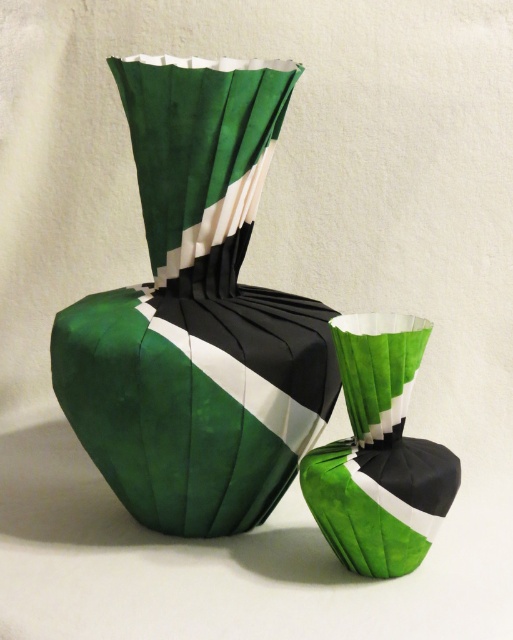
Is green paper vase at center wider than green paper at center?

Correct, the width of green paper vase at center exceeds that of green paper at center.

Which of these two, green paper vase at center or green paper at center, stands taller?

Standing taller between the two is green paper vase at center.

Does point (235, 61) lie behind point (404, 403)?

Yes, it is.

Where is `green paper vase at center`? This screenshot has height=640, width=513. green paper vase at center is located at coordinates (198, 314).